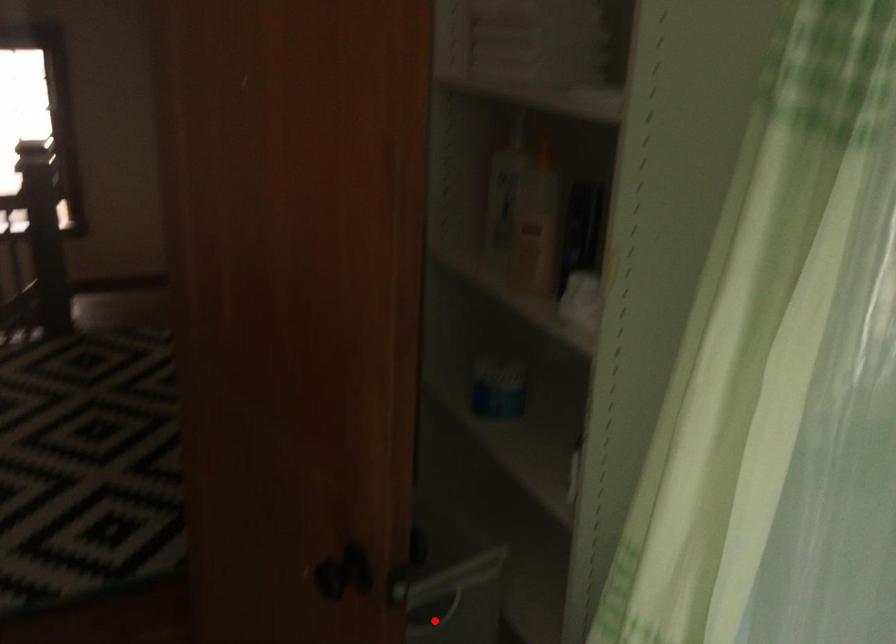
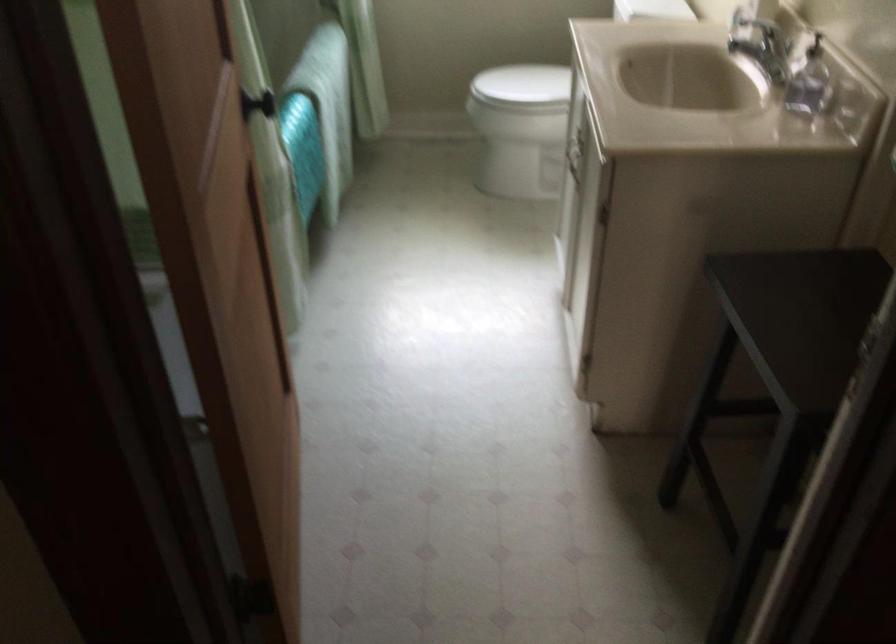
Question: I am providing you with two images of the same scene from different viewpoints. A red point is marked on the first image. At the location where the point appears in image 1, is it still visible in image 2?

Choices:
 (A) Yes
 (B) No

Answer: (B)